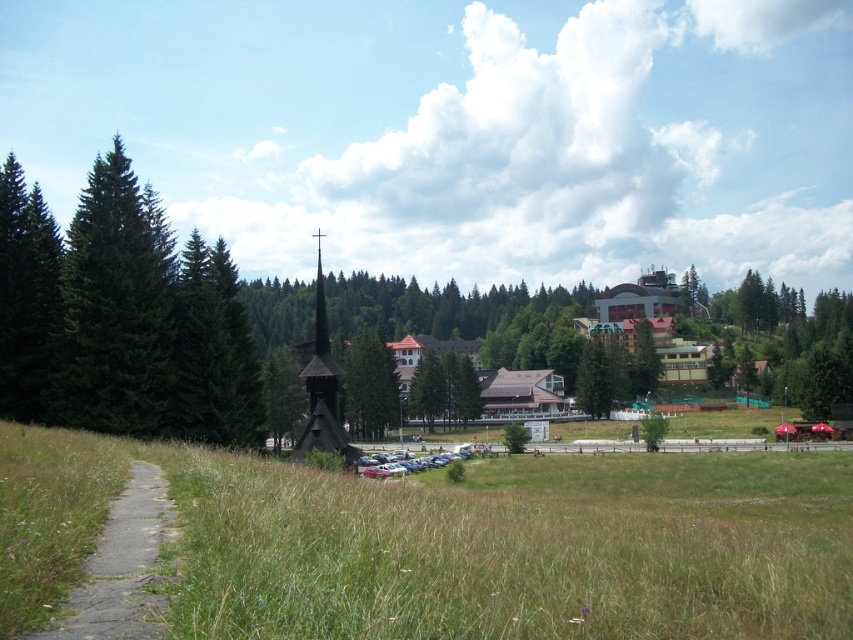
You are standing at the parking area and want to take a photo of the chapel. The two points you see are point (125, 500) and point (511, 428). Which point should you focus on to ensure the chapel is in the foreground of your photo?

Point (125, 500) should be focused on because it is closer to the camera than point (511, 428), ensuring the chapel appears in the foreground of the photo.

You are standing at the parking area and want to walk to the chapel. There is a green matte tree at left blocking your path. Can you walk around it?

The green matte tree at left is 53.71 meters away from you, so you can easily walk around it since it is not very close to your path.